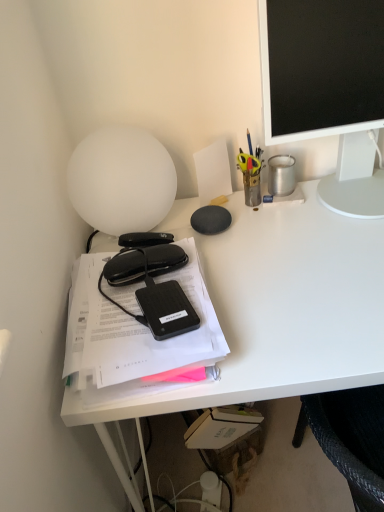
Find the location of a particular element. The width and height of the screenshot is (384, 512). vacant space behind black matte glasses case at left, the fourth stationery when ordered from right to left is located at coordinates (140, 234).